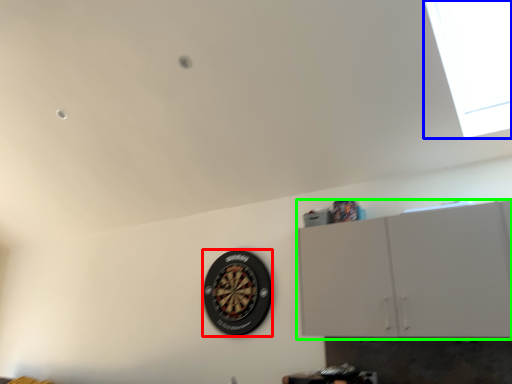
Question: Which object is the closest to the wheel (highlighted by a red box)? Choose among these: window (highlighted by a blue box) or cabinetry (highlighted by a green box).

Choices:
 (A) window
 (B) cabinetry

Answer: (B)